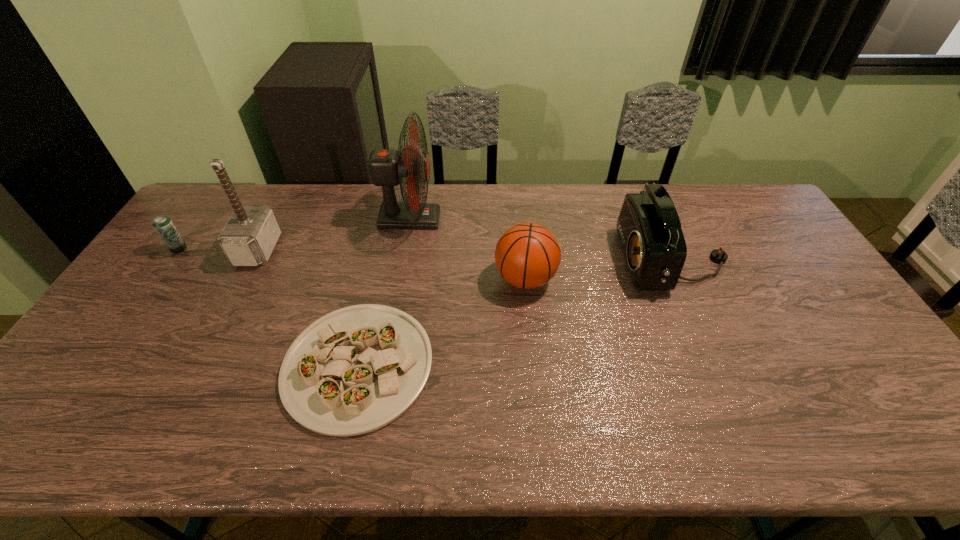
Where is `free space located 0.120m on the front-facing side of the fan`? free space located 0.120m on the front-facing side of the fan is located at coordinates (474, 219).

Where is `vacant point located 0.320m for striking with the head of the second object from left to right`? vacant point located 0.320m for striking with the head of the second object from left to right is located at coordinates (376, 249).

The image size is (960, 540). In order to click on free space located 0.210m on the front-facing side of the rightmost object in this screenshot , I will do `click(554, 261)`.

Locate an element on the screen. The image size is (960, 540). free region located on the front-facing side of the rightmost object is located at coordinates (564, 261).

The height and width of the screenshot is (540, 960). In order to click on vacant region located 0.140m on the front-facing side of the rightmost object in this screenshot , I will do `click(576, 261)`.

I want to click on vacant space located on the back of the basketball, so click(x=521, y=243).

Locate an element on the screen. This screenshot has width=960, height=540. vacant space located 0.250m on the back of the leftmost object is located at coordinates (214, 198).

You are a GUI agent. You are given a task and a screenshot of the screen. Output one action in this format:
    pyautogui.click(x=<x>, y=<y>)
    Task: Click on the vacant space located 0.290m on the left of the shortest object
    This screenshot has height=540, width=960.
    Given the screenshot: What is the action you would take?
    pyautogui.click(x=169, y=365)

Identify the location of object situated at the far edge. The height and width of the screenshot is (540, 960). (387, 167).

The width and height of the screenshot is (960, 540). What are the coordinates of `object situated at the near edge` in the screenshot? It's located at tap(355, 370).